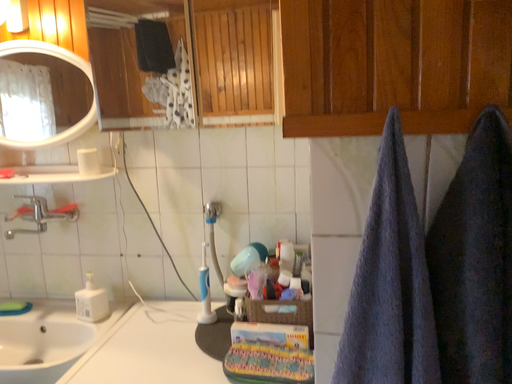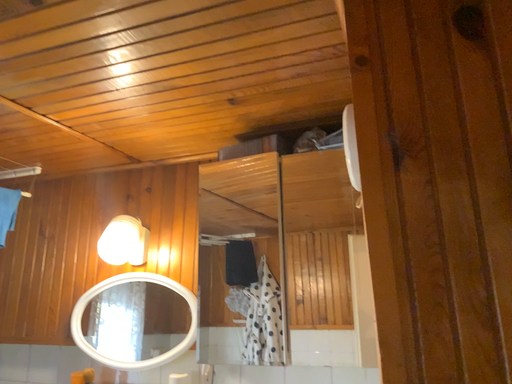
Question: Which way did the camera rotate in the video?

Choices:
 (A) rotated upward
 (B) rotated downward

Answer: (A)